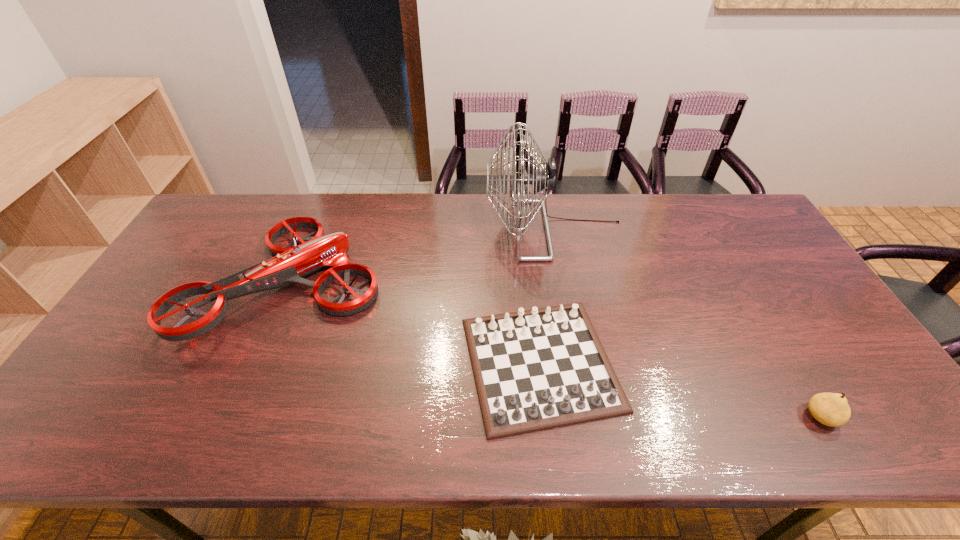
The width and height of the screenshot is (960, 540). What are the coordinates of `fan` in the screenshot? It's located at (542, 180).

Image resolution: width=960 pixels, height=540 pixels. Find the location of `drone`. drone is located at coordinates (290, 264).

Locate an element on the screen. pear is located at coordinates (831, 409).

Locate an element on the screen. This screenshot has height=540, width=960. chessboard is located at coordinates (544, 368).

What are the coordinates of `free location located on the front-facing side of the tallest object` in the screenshot? It's located at click(389, 230).

Find the location of a particular element. vacant region located 0.360m on the front-facing side of the tallest object is located at coordinates (379, 230).

Find the location of `blank space located on the front-facing side of the tallest object`. blank space located on the front-facing side of the tallest object is located at coordinates click(415, 230).

Locate an element on the screen. The height and width of the screenshot is (540, 960). vacant space situated 0.170m on the front of the leftmost object is located at coordinates (232, 417).

At what (x,y) coordinates should I click in order to perform the action: click on vacant area located 0.290m on the left of the pear. Please return your answer as a coordinate pair (x, y). Image resolution: width=960 pixels, height=540 pixels. Looking at the image, I should click on coord(678,417).

I want to click on free space located on the back of the shortest object, so click(x=528, y=259).